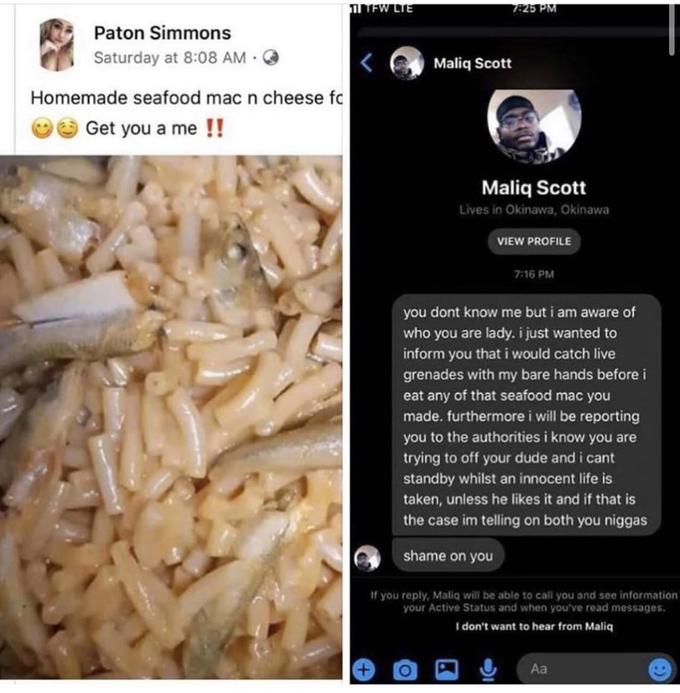
Locate an element on the screen. clock is located at coordinates (538, 8).